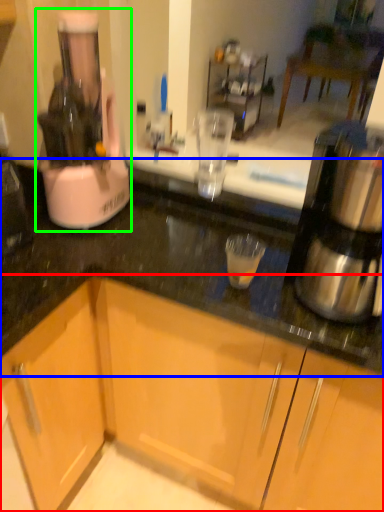
Question: Which is farther away from cabinetry (highlighted by a red box)? countertop (highlighted by a blue box) or home appliance (highlighted by a green box)?

Choices:
 (A) countertop
 (B) home appliance

Answer: (B)